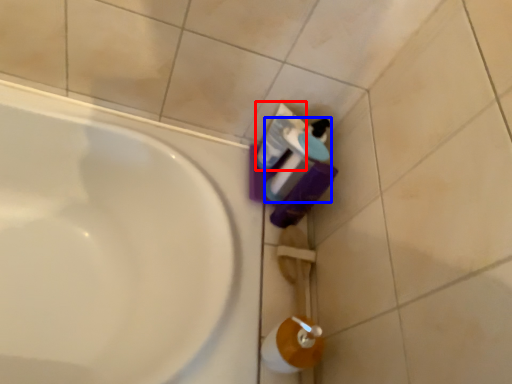
Question: Among these objects, which one is farthest to the camera, mouthwash (highlighted by a red box) or cleaning product (highlighted by a blue box)?

Choices:
 (A) mouthwash
 (B) cleaning product

Answer: (A)